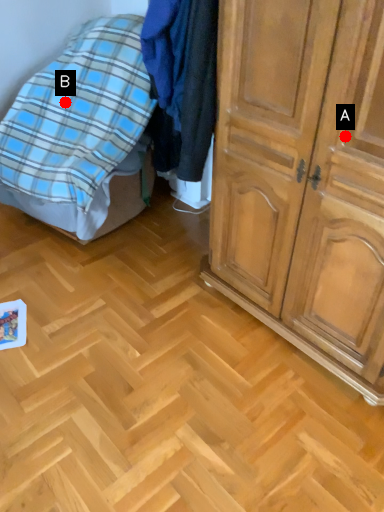
Question: Two points are circled on the image, labeled by A and B beside each circle. Which point appears farthest from the camera in this image?

Choices:
 (A) A is further
 (B) B is further

Answer: (B)